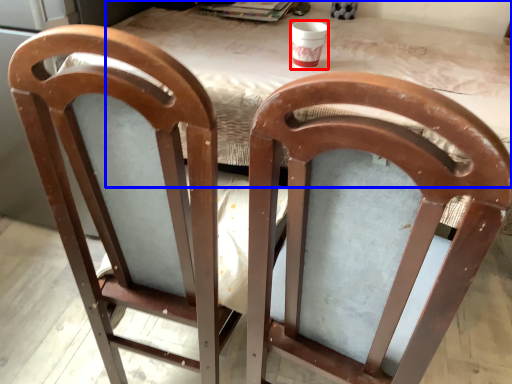
Question: Which point is closer to the camera, cup (highlighted by a red box) or table (highlighted by a blue box)?

Choices:
 (A) cup
 (B) table

Answer: (B)